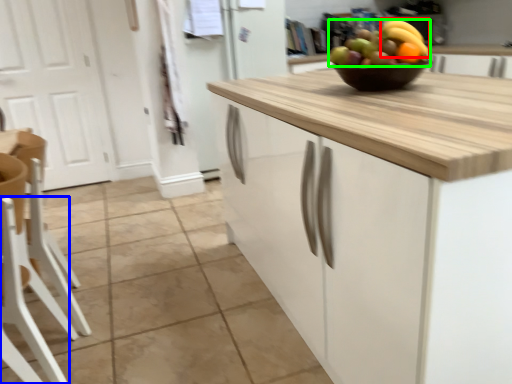
Question: Which is farther away from banana (highlighted by a red box)? chair (highlighted by a blue box) or grapefruit (highlighted by a green box)?

Choices:
 (A) chair
 (B) grapefruit

Answer: (A)